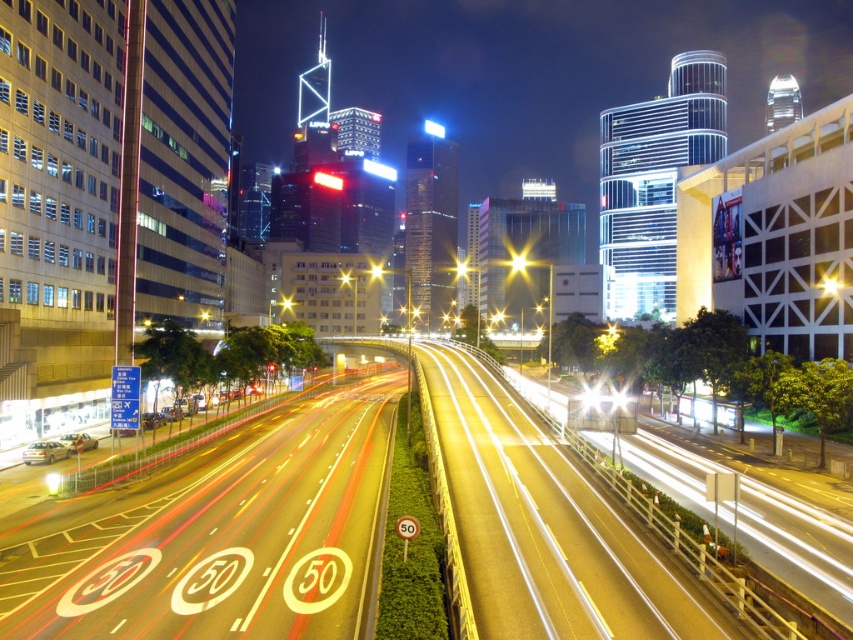
Is the position of white glossy highway at center less distant than that of yellow metallic streetlight at center?

That is True.

Measure the distance between white glossy highway at center and camera.

white glossy highway at center is 56.62 feet from camera.

Does point (119, 524) come behind point (467, 266)?

No, it is in front of (467, 266).

Locate an element on the screen. white glossy highway at center is located at coordinates (224, 538).

Can you confirm if white glossy highway at center is thinner than bright yellow light at center?

Yes, white glossy highway at center is thinner than bright yellow light at center.

Is white glossy highway at center above bright yellow light at center?

Incorrect, white glossy highway at center is not positioned above bright yellow light at center.

Is point (341, 541) positioned after point (520, 268)?

That is False.

The width and height of the screenshot is (853, 640). I want to click on white glossy highway at center, so click(224, 538).

Is white glossy highway at center positioned before yellow asphalt highway at center?

No, white glossy highway at center is further to the viewer.

Is white glossy highway at center wider than yellow asphalt highway at center?

Yes.

Is point (219, 579) positioned behind point (596, 593)?

Yes.

Identify the location of white glossy highway at center. (224, 538).